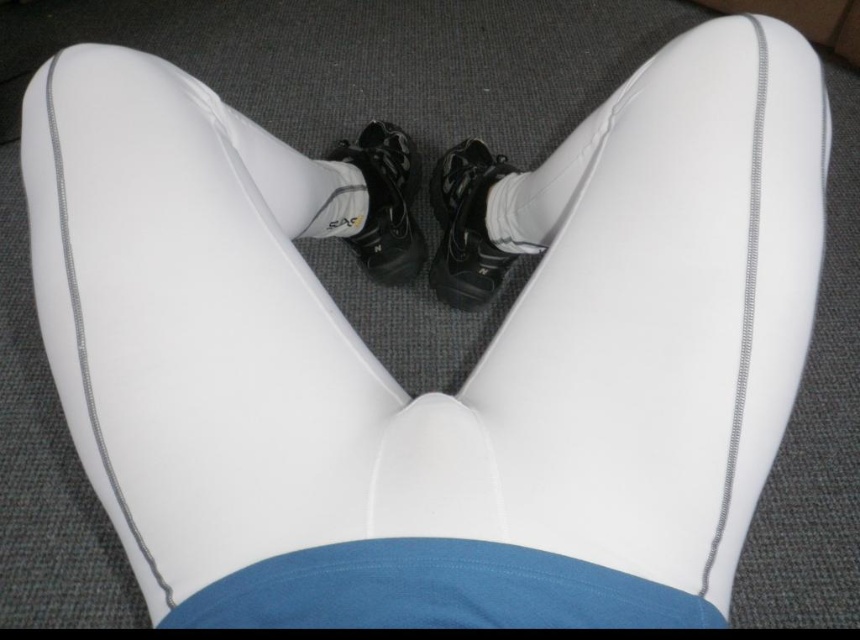
You are a fashion designer analyzing the positioning of the black matte shoe at center in the image. Based on its coordinates, is it closer to the left or right edge of the frame?

The black matte shoe at center is located at point 0.355 on the x and y axis, which is closer to the left edge of the frame since 0.355 is less than 0.5.

You are a photographer setting up a shoot. You need to adjust the lighting to ensure the black matte shoe at center and the shiny black shoe at center are both visible. Since one is closer to the camera, which shoe should you focus on first to make sure it appears sharp?

The black matte shoe at center is closer to the viewer than the shiny black shoe at center, so you should focus on the black matte shoe at center first to ensure it appears sharp.

You are a photographer setting up a shoot. You want to place a small prop exactly halfway between the shiny black shoe at center and the edge of the frame closest to it. The prop should be 0.5 meters away from the shoe. Is this possible?

The shiny black shoe at center is 1.17 meters away from the viewer. To place the prop halfway between the shoe and the edge of the frame closest to it, the distance from the shoe to the edge must be at least 1 meter. Since the required distance between the prop and the shoe is 0.5 meters, the total distance needed is 1.17 meters minus 0.5 meters equals 0.67 meters remaining to the edge. However, the prop needs to be halfway, so the total distance from the shoe to the edge must be double the 0.5 meters, so 1